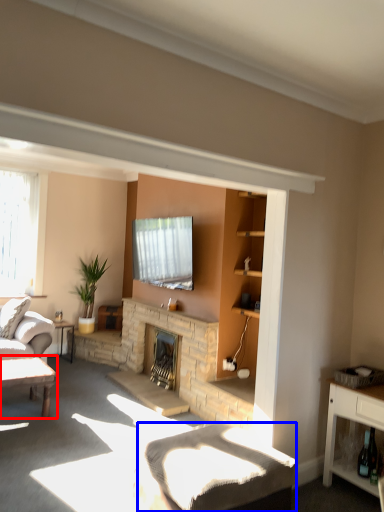
Question: Which of the following is the closest to the observer, table (highlighted by a red box) or plain (highlighted by a blue box)?

Choices:
 (A) table
 (B) plain

Answer: (B)